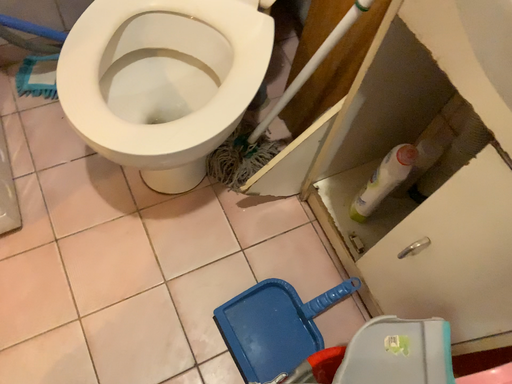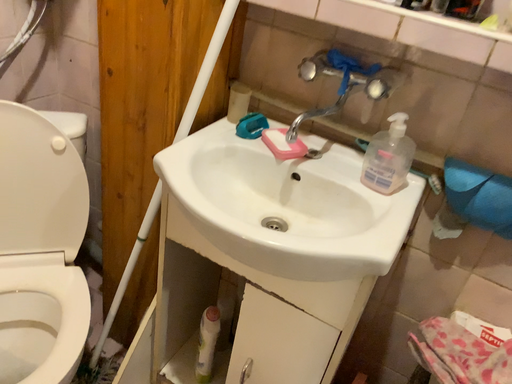
Question: How did the camera likely rotate when shooting the video?

Choices:
 (A) rotated upward
 (B) rotated downward

Answer: (A)